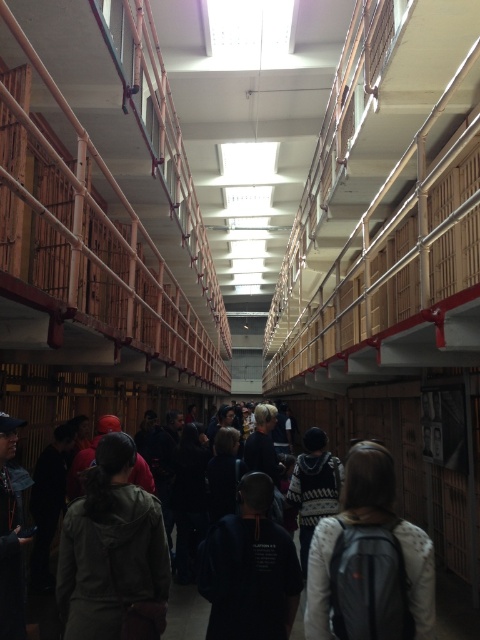
Question: Which object appears farthest from the camera in this image?

Choices:
 (A) dark gray backpack at center
 (B) dark gray hoodie at center
 (C) black matte sweatshirt at center
 (D) green matte jacket at center

Answer: (A)

Question: Is green matte jacket at center below dark gray backpack at center?

Choices:
 (A) yes
 (B) no

Answer: (B)

Question: Which object is the closest to the dark gray backpack at center?

Choices:
 (A) white sweater at center
 (B) green matte jacket at center
 (C) black matte sweatshirt at center

Answer: (C)

Question: Is white sweater at center smaller than dark gray backpack at center?

Choices:
 (A) no
 (B) yes

Answer: (B)

Question: Is white sweater at center bigger than dark gray hoodie at center?

Choices:
 (A) no
 (B) yes

Answer: (B)

Question: Which of the following is the farthest from the observer?

Choices:
 (A) green matte jacket at center
 (B) black matte sweatshirt at center

Answer: (B)